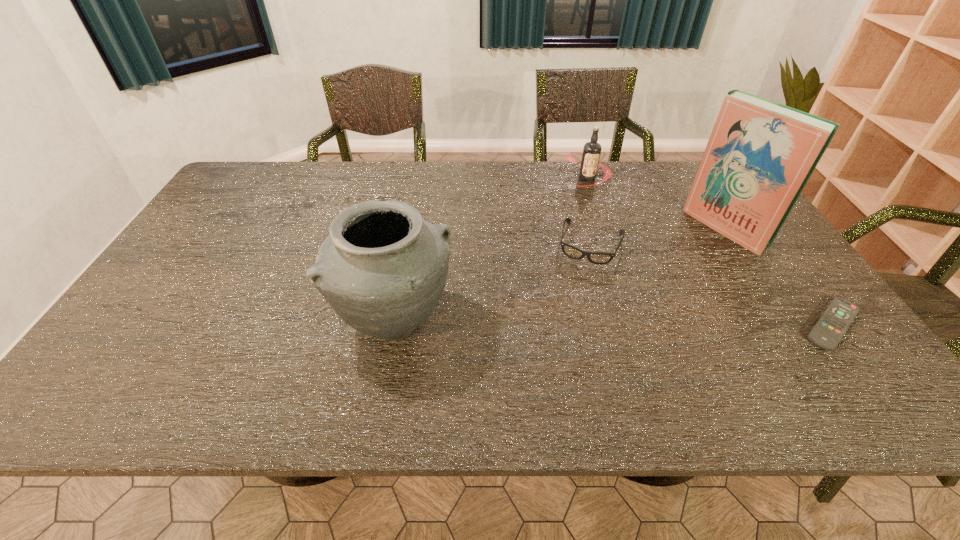
Locate an element on the screen. Image resolution: width=960 pixels, height=540 pixels. remote control situated at the near edge is located at coordinates (828, 331).

Find the location of a particular element. This screenshot has width=960, height=540. remote control present at the right edge is located at coordinates (828, 331).

You are a GUI agent. You are given a task and a screenshot of the screen. Output one action in this format:
    pyautogui.click(x=<x>, y=<y>)
    Task: Click on the hardback book present at the right edge
    
    Given the screenshot: What is the action you would take?
    pyautogui.click(x=760, y=155)

Locate an element on the screen. object at the near right corner is located at coordinates (828, 331).

At what (x,y) coordinates should I click in order to perform the action: click on vacant area at the far edge. Please return your answer as a coordinate pair (x, y). Looking at the image, I should click on (351, 176).

You are a GUI agent. You are given a task and a screenshot of the screen. Output one action in this format:
    pyautogui.click(x=<x>, y=<y>)
    Task: Click on the vacant space at the near edge of the desktop
    
    Given the screenshot: What is the action you would take?
    pyautogui.click(x=412, y=355)

At what (x,y) coordinates should I click in order to perform the action: click on vacant space at the left edge of the desktop. Please return your answer as a coordinate pair (x, y). The height and width of the screenshot is (540, 960). Looking at the image, I should click on (186, 243).

Where is `vacant space at the right edge of the desktop`? vacant space at the right edge of the desktop is located at coordinates (734, 255).

Find the location of a particular element. This screenshot has width=960, height=540. free space at the near left corner of the desktop is located at coordinates (129, 349).

You are a GUI agent. You are given a task and a screenshot of the screen. Output one action in this format:
    pyautogui.click(x=<x>, y=<y>)
    Task: Click on the vacant space at the far right corner of the desktop
    This screenshot has height=540, width=960.
    Given the screenshot: What is the action you would take?
    pyautogui.click(x=684, y=190)